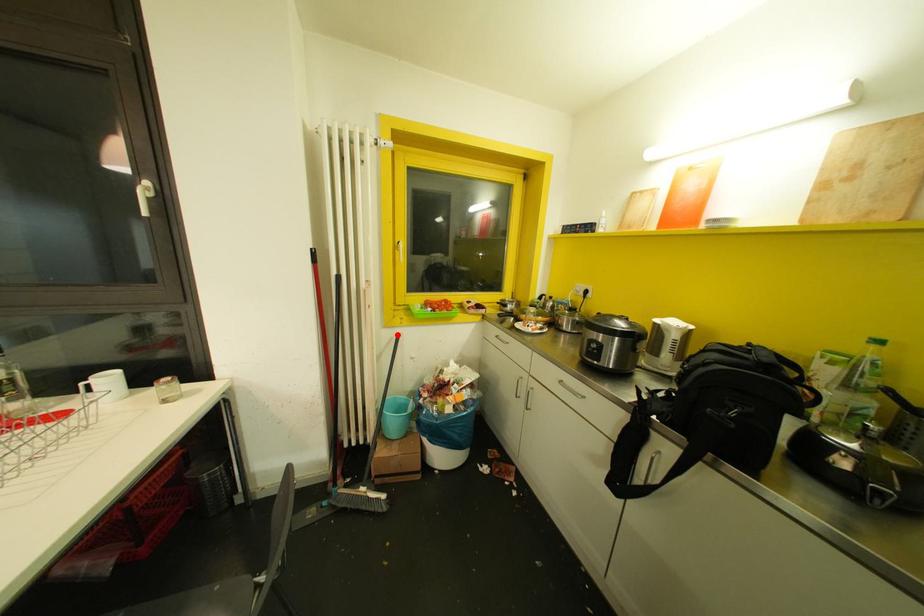
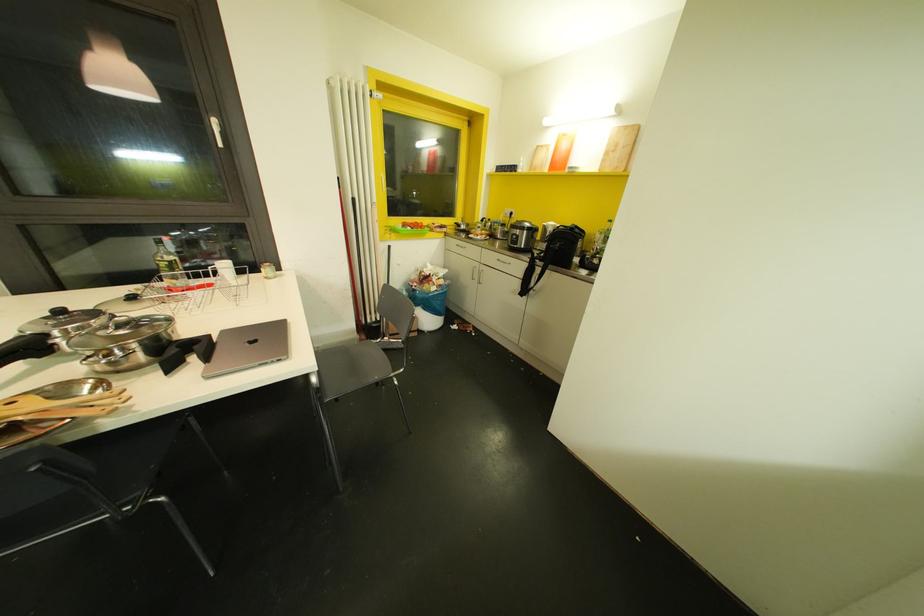
Question: I am providing you with two images of the same scene from different viewpoints. Image1 has a red point marked. In image2, the corresponding 3D location appears at what relative position? Reply with the corresponding letter.

Choices:
 (A) Closer
 (B) Farther

Answer: (A)